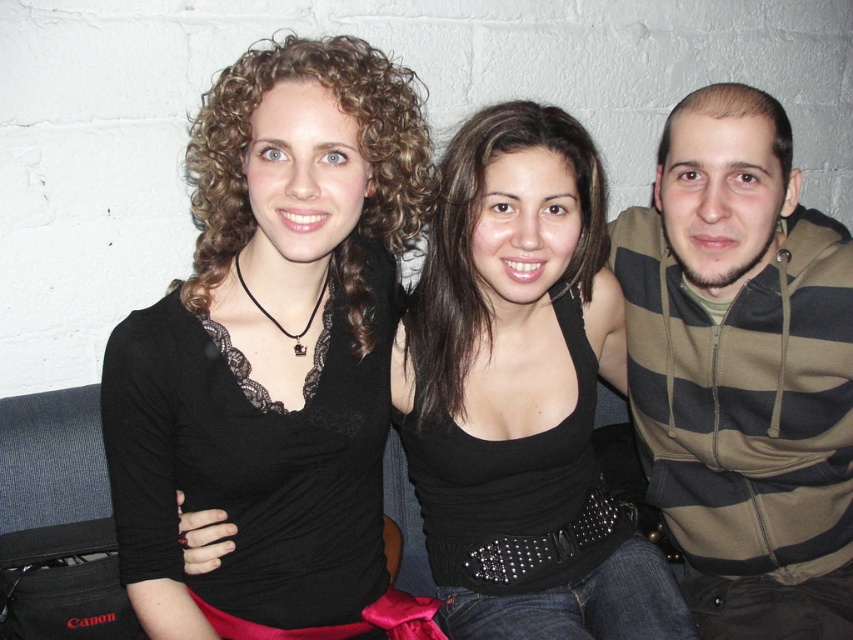
Question: Which of the following is the farthest from the observer?

Choices:
 (A) (587, 177)
 (B) (619, 273)
 (C) (189, 451)

Answer: (B)

Question: Is black leather tank top at center further to camera compared to striped hoodie at right?

Choices:
 (A) no
 (B) yes

Answer: (A)

Question: Does black lace top at center have a smaller size compared to striped hoodie at right?

Choices:
 (A) no
 (B) yes

Answer: (A)

Question: Which point is closer to the camera?

Choices:
 (A) black leather tank top at center
 (B) striped hoodie at right
 (C) black lace top at center

Answer: (C)

Question: Which of these objects is positioned farthest from the black lace top at center?

Choices:
 (A) black leather tank top at center
 (B) striped hoodie at right

Answer: (B)

Question: Does black lace top at center come behind striped hoodie at right?

Choices:
 (A) yes
 (B) no

Answer: (B)